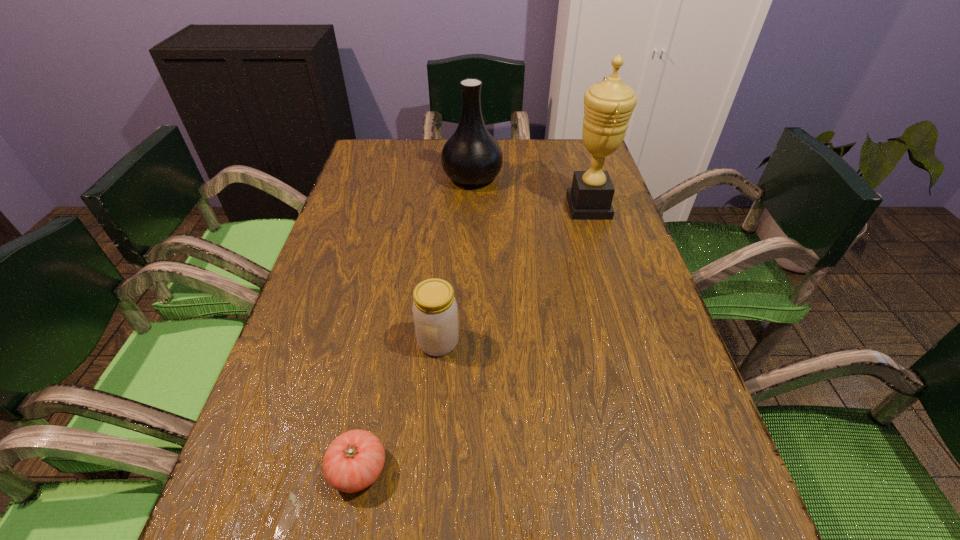
At what (x,y) coordinates should I click in order to perform the action: click on blank area in the image that satisfies the following two spatial constraints: 1. on the back side of the shortest object; 2. on the left side of the second tallest object. Please return your answer as a coordinate pair (x, y). Looking at the image, I should click on (416, 177).

At what (x,y) coordinates should I click in order to perform the action: click on free spot that satisfies the following two spatial constraints: 1. on the back side of the second tallest object; 2. on the right side of the jar. Please return your answer as a coordinate pair (x, y). The image size is (960, 540). Looking at the image, I should click on (452, 177).

You are a GUI agent. You are given a task and a screenshot of the screen. Output one action in this format:
    pyautogui.click(x=<x>, y=<y>)
    Task: Click on the vacant point that satisfies the following two spatial constraints: 1. on the back side of the second tallest object; 2. on the left side of the second shortest object
    The image size is (960, 540).
    Given the screenshot: What is the action you would take?
    pyautogui.click(x=452, y=177)